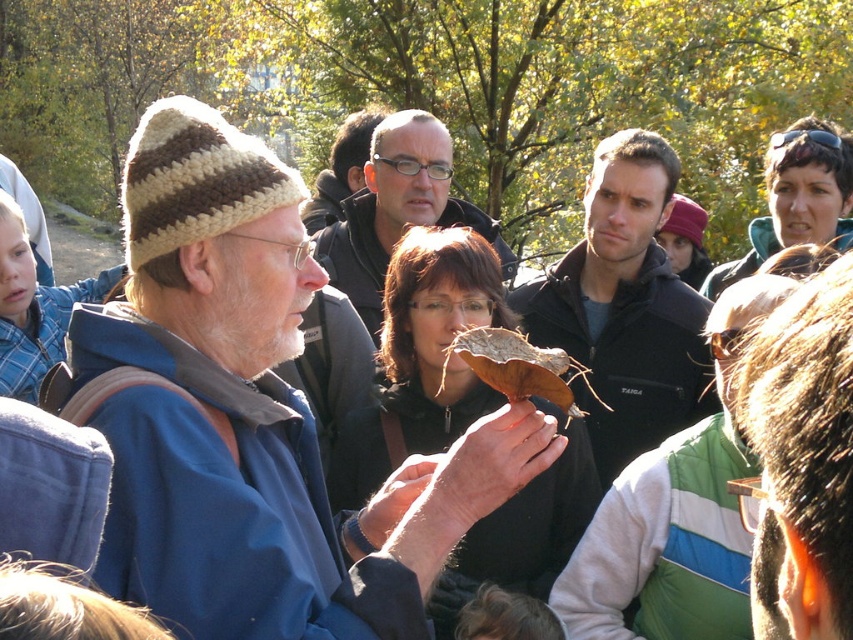
Question: Can you confirm if matte black jacket at center is positioned to the left of brown rough bark at center?

Choices:
 (A) no
 (B) yes

Answer: (B)

Question: Which point appears farthest from the camera in this image?

Choices:
 (A) (521, 406)
 (B) (381, 140)
 (C) (650, 204)
 (D) (514, 346)

Answer: (B)

Question: Can you confirm if knitted wool hat at left is positioned below dark brown leather jacket at center?

Choices:
 (A) no
 (B) yes

Answer: (B)

Question: In this image, where is dark brown leather jacket at center located relative to brown rough bark at center?

Choices:
 (A) above
 (B) below

Answer: (A)

Question: Which object is farther from the camera taking this photo?

Choices:
 (A) knitted wool hat at left
 (B) matte black jacket at center
 (C) dark brown leather jacket at center
 (D) brown rough bark at center

Answer: (B)

Question: Which object appears closest to the camera in this image?

Choices:
 (A) dark brown leather jacket at center
 (B) brown rough bark at center
 (C) matte black jacket at center

Answer: (B)